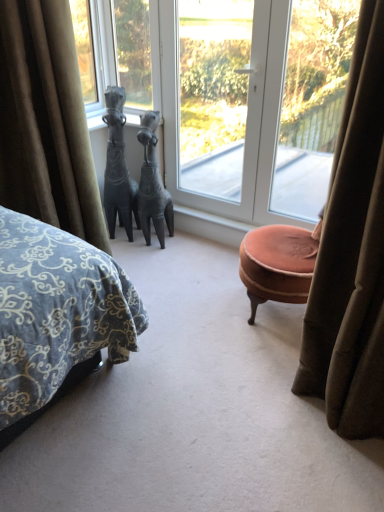
Image resolution: width=384 pixels, height=512 pixels. What are the coordinates of `free space to the right of bronze horse at center` in the screenshot? It's located at (183, 240).